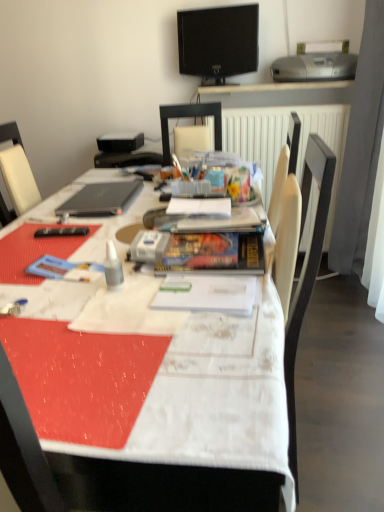
Find the location of `vacant location behind clear plastic bottle at center`. vacant location behind clear plastic bottle at center is located at coordinates (108, 258).